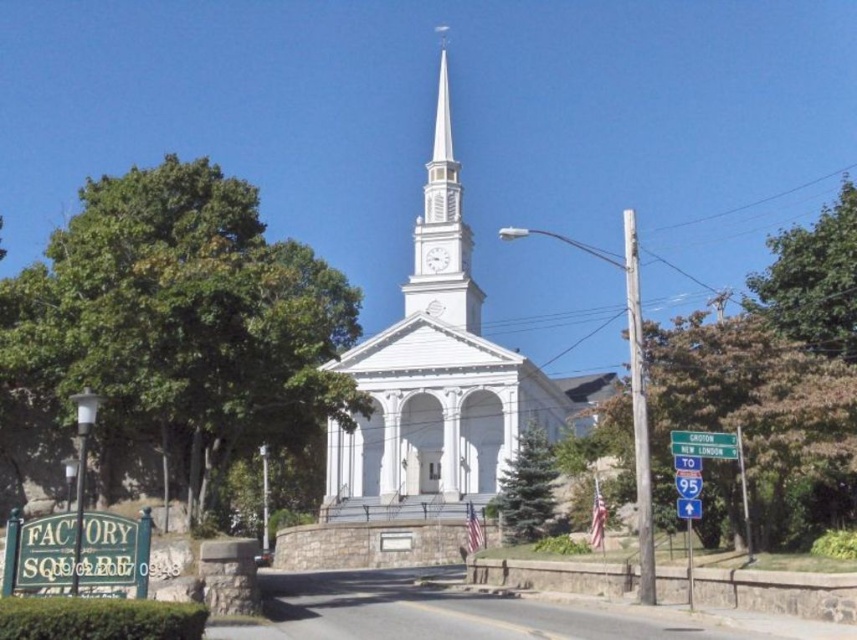
Question: Is green leafy tree at left thinner than brown textured tree at right?

Choices:
 (A) yes
 (B) no

Answer: (B)

Question: Is brown textured tree at right closer to the viewer compared to green leafy tree at upper right?

Choices:
 (A) no
 (B) yes

Answer: (B)

Question: Is green leafy tree at upper right above white smooth steeple at center?

Choices:
 (A) yes
 (B) no

Answer: (B)

Question: Estimate the real-world distances between objects in this image. Which object is farther from the white smooth church steeple at center?

Choices:
 (A) white smooth steeple at center
 (B) green leafy tree at left
 (C) brown textured tree at right

Answer: (C)

Question: Which object appears closest to the camera in this image?

Choices:
 (A) green leafy tree at upper right
 (B) white smooth church steeple at center
 (C) green coniferous tree at center

Answer: (A)

Question: Among these points, which one is farthest from the camera?

Choices:
 (A) (15, 406)
 (B) (399, 385)

Answer: (B)